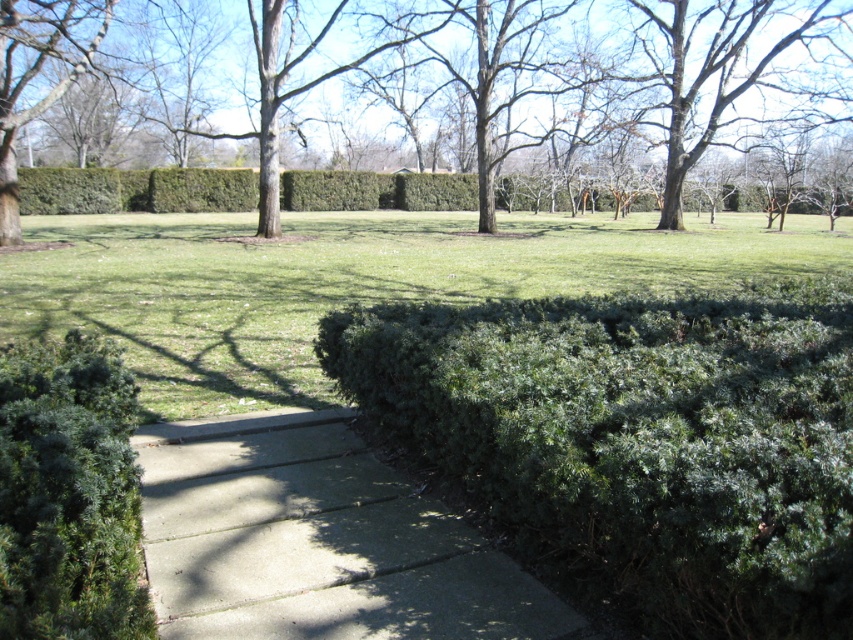
Does green leafy bush at center appear on the left side of green leafy tree at upper left?

Incorrect, green leafy bush at center is not on the left side of green leafy tree at upper left.

Measure the distance between green leafy bush at center and green leafy tree at upper left.

green leafy bush at center is 10.74 meters away from green leafy tree at upper left.

Is point (544, 35) positioned in front of point (51, 61)?

No, it is not.

Identify the location of green leafy bush at center. (560, 80).

Can you confirm if green leafy hedge at center is positioned to the right of green leafy tree at upper left?

Indeed, green leafy hedge at center is positioned on the right side of green leafy tree at upper left.

Can you confirm if green leafy hedge at center is smaller than green leafy tree at upper left?

Yes, green leafy hedge at center is smaller than green leafy tree at upper left.

Image resolution: width=853 pixels, height=640 pixels. In order to click on green leafy hedge at center in this screenshot , I will do `click(637, 440)`.

Consider the image. Is green leafy hedge at center positioned in front of green leafy bush at center?

Yes, it is.

Who is lower down, green leafy hedge at center or green leafy bush at center?

green leafy hedge at center

Who is more distant from viewer, (701,428) or (635,4)?

Positioned behind is point (635,4).

Find the location of a particular element. This screenshot has width=853, height=640. green leafy hedge at center is located at coordinates (637, 440).